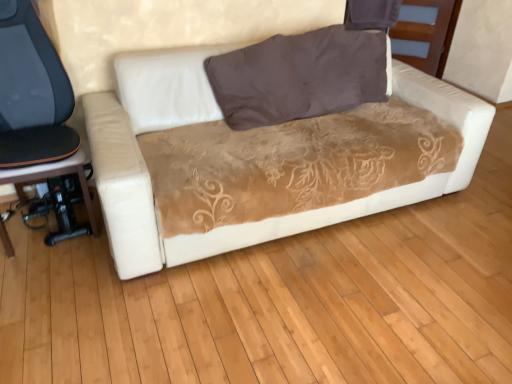
At what (x,y) coordinates should I click in order to perform the action: click on vacant area that lies between velvet brown couch at center and black leather chair at left. Please return your answer as a coordinate pair (x, y). The image size is (512, 384). Looking at the image, I should click on (74, 271).